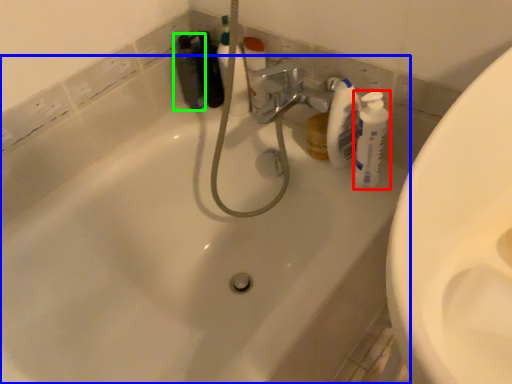
Question: Which object is positioned closest to cleaning product (highlighted by a red box)? Select from bathtub (highlighted by a blue box) and toiletry (highlighted by a green box).

Choices:
 (A) bathtub
 (B) toiletry

Answer: (A)